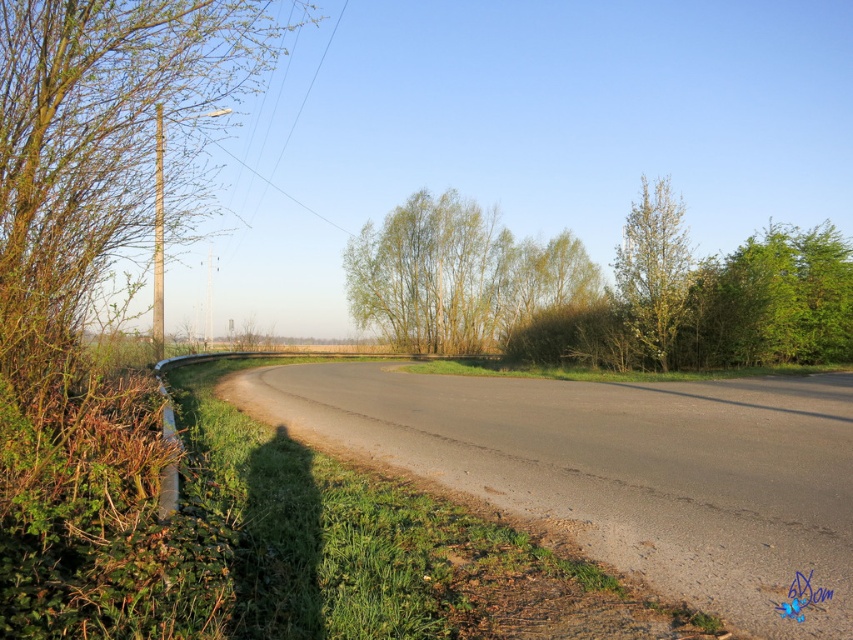
You are a drone operator trying to capture aerial footage of the rural scene. You have two points marked on your map, point 1 at coordinates point (730, 337) and point 2 at coordinates point (643, 186). Your camera has a limited zoom range and can only focus on objects within a certain distance from the drone. If you want to capture both points in a single shot, which point should you position the drone closer to?

You should position the drone closer to point (643, 186) because it is farther from the camera than point (730, 337). By placing the drone closer to the farther point, you can ensure both points are within the camera range.

You are a hiker standing on the curved road and want to take a photo of both the green leafy tree at left and the green leafy tree at upper right. Which tree should you move towards to get both in the frame without changing your camera angle?

You should move towards the green leafy tree at upper right because it is farther away from you than the green leafy tree at left, so moving towards it will help both trees fit within the camera frame.